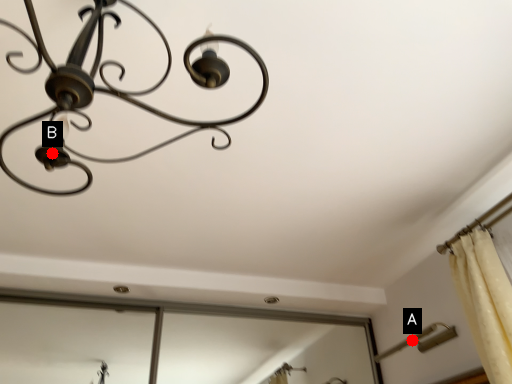
Question: Two points are circled on the image, labeled by A and B beside each circle. Which point appears farthest from the camera in this image?

Choices:
 (A) A is further
 (B) B is further

Answer: (A)